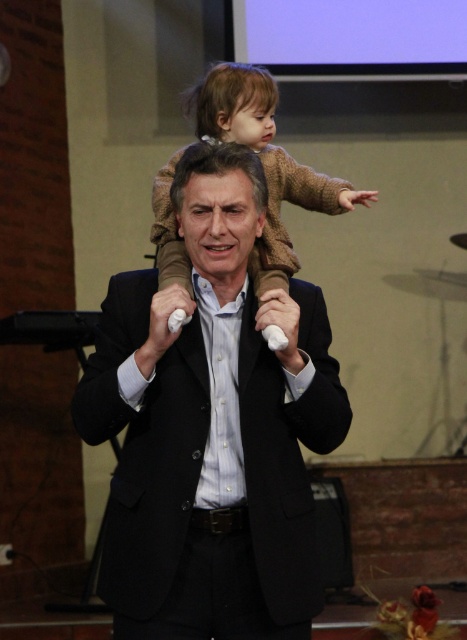
Question: Observing the image, what is the correct spatial positioning of matte black suit at center in reference to light brown wool sweater at upper center?

Choices:
 (A) above
 (B) below

Answer: (B)

Question: Does matte black suit at center come behind light brown wool sweater at upper center?

Choices:
 (A) no
 (B) yes

Answer: (A)

Question: Among these points, which one is nearest to the camera?

Choices:
 (A) (240, 138)
 (B) (122, 320)

Answer: (B)

Question: Which of the following is the closest to the observer?

Choices:
 (A) matte black suit at center
 (B) light brown wool sweater at upper center

Answer: (A)

Question: Does matte black suit at center appear on the left side of light brown wool sweater at upper center?

Choices:
 (A) yes
 (B) no

Answer: (A)